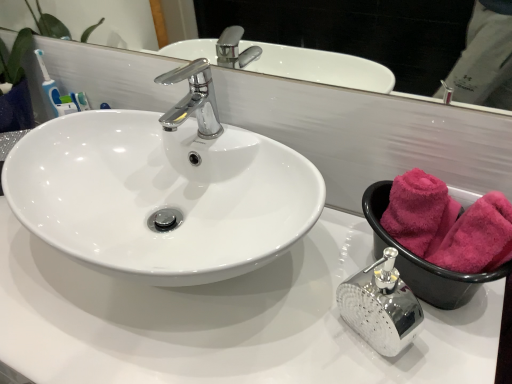
Question: From a real-world perspective, is polished chrome soap dispenser at lower right located higher than pink fluffy towel at right, which appears as the second bath towel when viewed from the front?

Choices:
 (A) no
 (B) yes

Answer: (A)

Question: Does polished chrome soap dispenser at lower right have a smaller size compared to pink fluffy towel at right, which appears as the second bath towel when viewed from the front?

Choices:
 (A) yes
 (B) no

Answer: (B)

Question: Is polished chrome soap dispenser at lower right not within pink fluffy towel at right, arranged as the 1th bath towel when viewed from the back?

Choices:
 (A) yes
 (B) no

Answer: (A)

Question: From a real-world perspective, is polished chrome soap dispenser at lower right physically below pink fluffy towel at right, arranged as the 1th bath towel when viewed from the back?

Choices:
 (A) no
 (B) yes

Answer: (B)

Question: Does polished chrome soap dispenser at lower right have a lesser height compared to pink fluffy towel at right, which appears as the second bath towel when viewed from the front?

Choices:
 (A) no
 (B) yes

Answer: (A)

Question: Does polished chrome soap dispenser at lower right lie in front of pink fluffy towel at right, arranged as the 1th bath towel when viewed from the back?

Choices:
 (A) yes
 (B) no

Answer: (A)

Question: Does pink fluffy towel at right, arranged as the 1th bath towel when viewed from the back, lie in front of glossy white mirror at upper center?

Choices:
 (A) yes
 (B) no

Answer: (B)

Question: Can you confirm if pink fluffy towel at right, which appears as the second bath towel when viewed from the front, is positioned to the right of glossy white mirror at upper center?

Choices:
 (A) no
 (B) yes

Answer: (B)

Question: Does pink fluffy towel at right, which appears as the second bath towel when viewed from the front, contain glossy white mirror at upper center?

Choices:
 (A) yes
 (B) no

Answer: (B)

Question: From a real-world perspective, is pink fluffy towel at right, arranged as the 1th bath towel when viewed from the back, under glossy white mirror at upper center?

Choices:
 (A) yes
 (B) no

Answer: (A)

Question: Is pink fluffy towel at right, arranged as the 1th bath towel when viewed from the back, positioned with its back to glossy white mirror at upper center?

Choices:
 (A) no
 (B) yes

Answer: (A)

Question: From a real-world perspective, is pink fluffy towel at right, arranged as the 1th bath towel when viewed from the back, on top of glossy white mirror at upper center?

Choices:
 (A) no
 (B) yes

Answer: (A)

Question: Is white glossy sink at center located within pink soft towel at right?

Choices:
 (A) no
 (B) yes

Answer: (A)